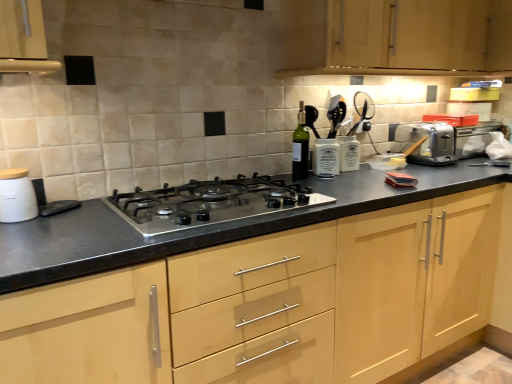
Question: From a real-world perspective, is green glass bottle at center physically located above or below satin black gas stove at center?

Choices:
 (A) below
 (B) above

Answer: (B)

Question: Based on their sizes in the image, would you say green glass bottle at center is bigger or smaller than satin black gas stove at center?

Choices:
 (A) small
 (B) big

Answer: (A)

Question: Estimate the real-world distances between objects in this image. Which object is farther from the green glass bottle at center?

Choices:
 (A) light wood cabinet at center, the first cabinetry when ordered from bottom to top
 (B) silver metallic toaster at right
 (C) white matte canister at left
 (D) light wood cabinet at upper center, which is the 2th cabinetry from bottom to top
 (E) satin black gas stove at center

Answer: (C)

Question: Considering the real-world distances, which object is closest to the light wood cabinet at center, the first cabinetry when ordered from bottom to top?

Choices:
 (A) white matte canister at left
 (B) satin black gas stove at center
 (C) green glass bottle at center
 (D) silver metallic toaster at right
 (E) light wood cabinet at upper center, which is the 2th cabinetry from bottom to top

Answer: (B)